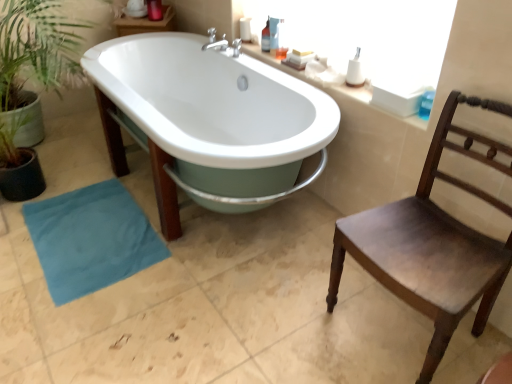
Question: Does teal fabric towel at lower left have a lesser height compared to translucent plastic bottle at upper right, the 2th toiletry in the bottom-to-top sequence?

Choices:
 (A) no
 (B) yes

Answer: (B)

Question: Is teal fabric towel at lower left positioned with its back to translucent plastic bottle at upper right, which is counted as the first toiletry, starting from the back?

Choices:
 (A) no
 (B) yes

Answer: (A)

Question: Is teal fabric towel at lower left positioned far away from translucent plastic bottle at upper right, the 2th toiletry in the right-to-left sequence?

Choices:
 (A) yes
 (B) no

Answer: (A)

Question: Does teal fabric towel at lower left appear on the right side of translucent plastic bottle at upper right, marked as the 1th toiletry in a left-to-right arrangement?

Choices:
 (A) no
 (B) yes

Answer: (A)

Question: Is teal fabric towel at lower left wider than translucent plastic bottle at upper right, which is counted as the first toiletry, starting from the back?

Choices:
 (A) yes
 (B) no

Answer: (A)

Question: Is teal fabric towel at lower left to the left or to the right of white plastic toothbrush at upper right, arranged as the second toiletry when viewed from the back, in the image?

Choices:
 (A) left
 (B) right

Answer: (A)

Question: Considering the positions of teal fabric towel at lower left and white plastic toothbrush at upper right, which is the 1th toiletry from right to left, in the image, is teal fabric towel at lower left taller or shorter than white plastic toothbrush at upper right, which is the 1th toiletry from right to left,?

Choices:
 (A) short
 (B) tall

Answer: (A)

Question: Choose the correct answer: Is teal fabric towel at lower left inside white plastic toothbrush at upper right, the 2th toiletry viewed from the top, or outside it?

Choices:
 (A) outside
 (B) inside

Answer: (A)

Question: Looking at the image, does teal fabric towel at lower left seem bigger or smaller compared to white plastic toothbrush at upper right, the 2th toiletry viewed from the top?

Choices:
 (A) small
 (B) big

Answer: (B)

Question: Considering the positions of white glossy bathtub at center and white glossy counter top at upper center in the image, is white glossy bathtub at center taller or shorter than white glossy counter top at upper center?

Choices:
 (A) tall
 (B) short

Answer: (A)

Question: From the image's perspective, is white glossy bathtub at center located above or below white glossy counter top at upper center?

Choices:
 (A) above
 (B) below

Answer: (B)

Question: Is white glossy bathtub at center to the left or to the right of white glossy counter top at upper center in the image?

Choices:
 (A) left
 (B) right

Answer: (A)

Question: From a real-world perspective, relative to white glossy counter top at upper center, is white glossy bathtub at center vertically above or below?

Choices:
 (A) above
 (B) below

Answer: (B)

Question: Considering the positions of point (65, 269) and point (266, 21), is point (65, 269) closer or farther from the camera than point (266, 21)?

Choices:
 (A) closer
 (B) farther

Answer: (A)

Question: Considering the positions of teal fabric towel at lower left and translucent plastic bottle at upper right, the 2th toiletry in the right-to-left sequence, in the image, is teal fabric towel at lower left taller or shorter than translucent plastic bottle at upper right, the 2th toiletry in the right-to-left sequence,?

Choices:
 (A) tall
 (B) short

Answer: (B)